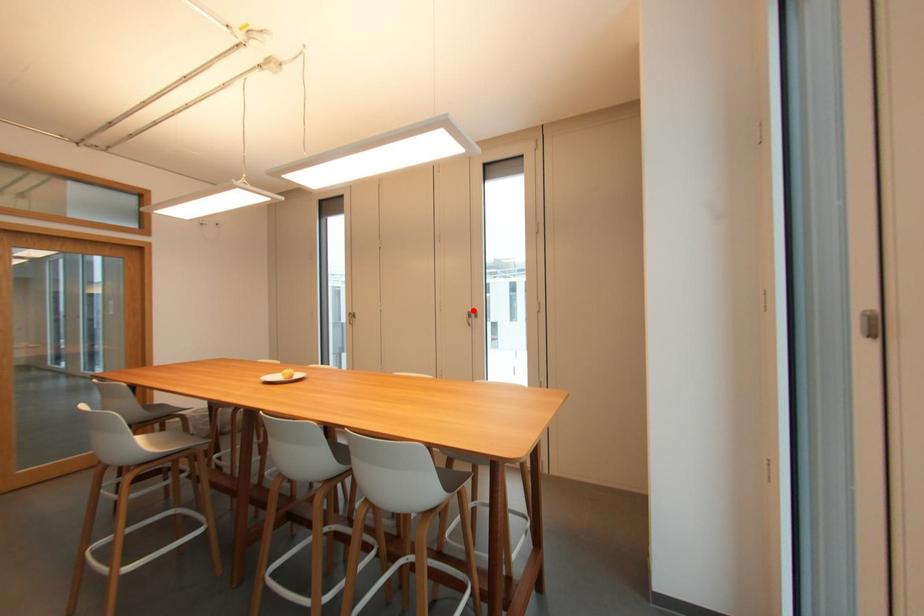
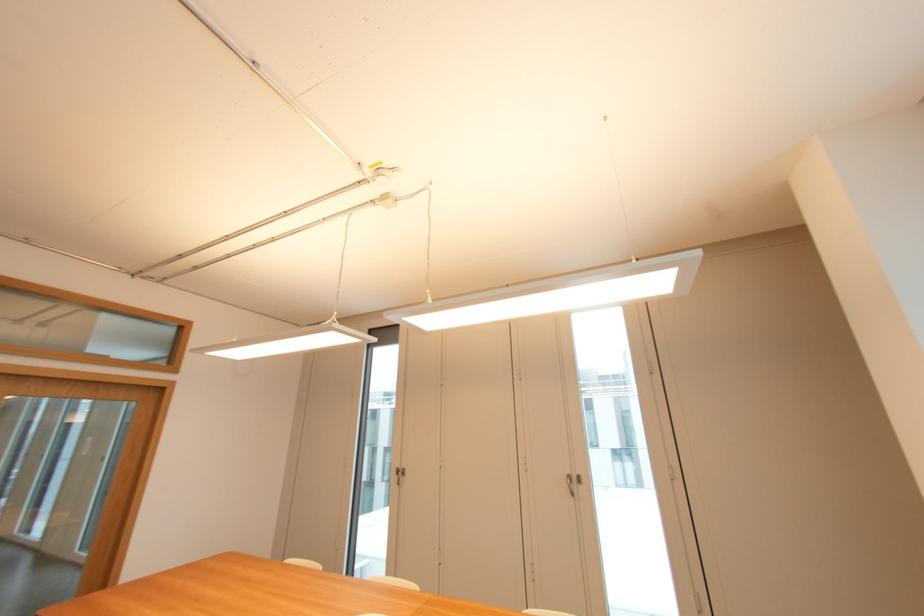
Locate, in the second image, the point that corresponds to the highlighted location in the first image.

(574, 472)